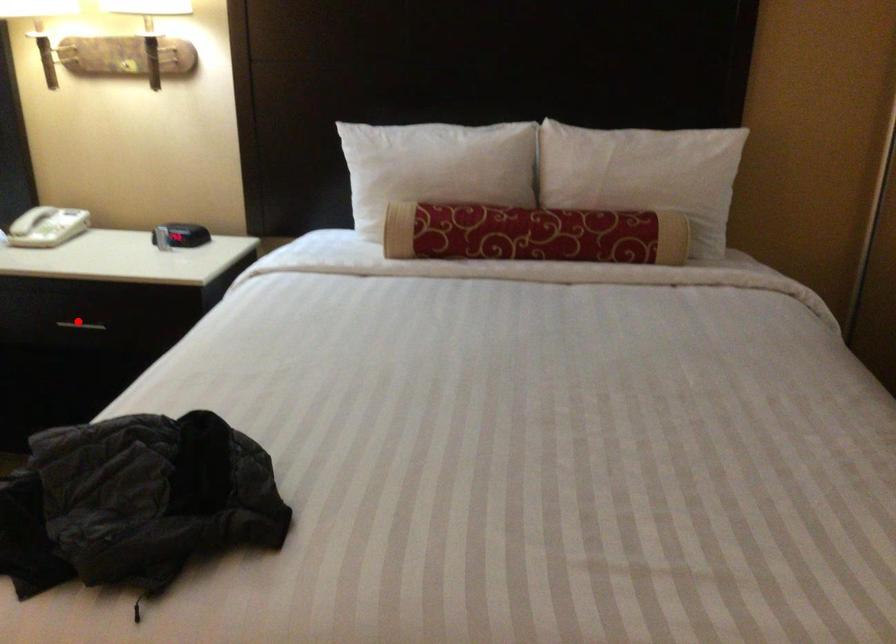
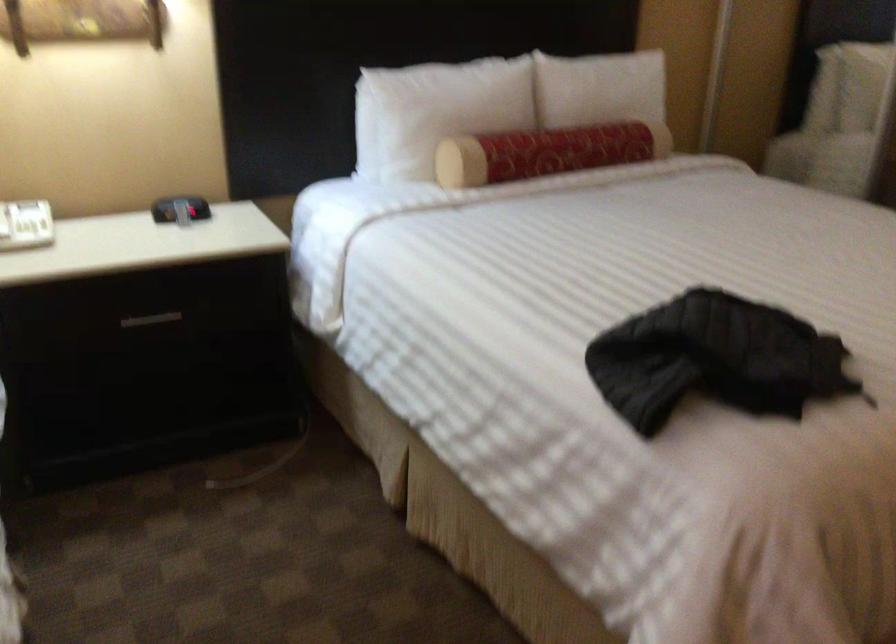
Question: A red point is marked in image1. In image2, is the corresponding 3D point closer to the camera or farther? Reply with the corresponding letter.

Choices:
 (A) The corresponding 3D point is closer.
 (B) The corresponding 3D point is farther.

Answer: (A)